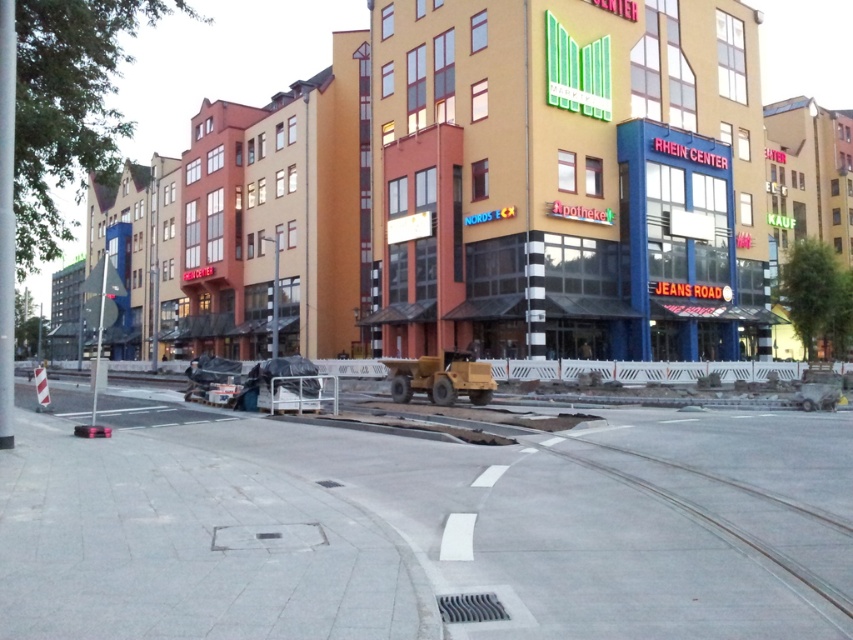
Who is higher up, concrete at center or gray concrete train track at lower right?

Positioned higher is gray concrete train track at lower right.

Which is more to the right, concrete at center or gray concrete train track at lower right?

gray concrete train track at lower right

Is point (74, 588) in front of point (805, 580)?

Yes, it is in front of point (805, 580).

This screenshot has width=853, height=640. I want to click on concrete at center, so click(422, 524).